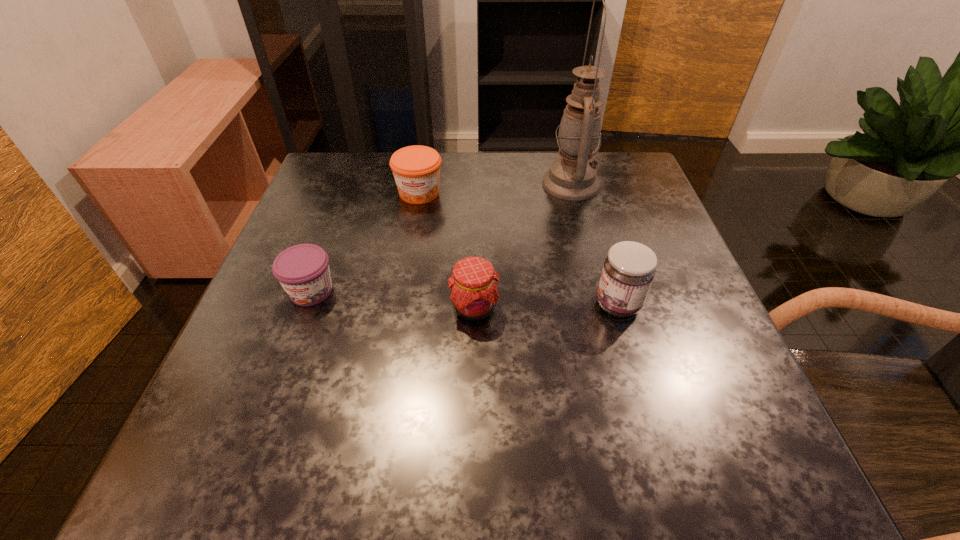
The height and width of the screenshot is (540, 960). Identify the location of free area in between the farthest jam and the leftmost jam. (365, 242).

Image resolution: width=960 pixels, height=540 pixels. What are the coordinates of `empty space between the third object from right to left and the oil lamp` in the screenshot? It's located at (522, 246).

Find the location of a particular element. This screenshot has height=540, width=960. empty space between the second object from left to right and the third jam from left to right is located at coordinates (446, 251).

Where is `unoccupied position between the shortest object and the farthest jam`? Image resolution: width=960 pixels, height=540 pixels. unoccupied position between the shortest object and the farthest jam is located at coordinates (365, 242).

I want to click on free point between the shortest object and the third jam from right to left, so click(x=365, y=242).

Identify the location of vacant space that's between the fourth object from right to left and the tallest object. The height and width of the screenshot is (540, 960). (495, 188).

Locate an element on the screen. vacant area that lies between the second jam from right to left and the tallest object is located at coordinates (522, 246).

Image resolution: width=960 pixels, height=540 pixels. What are the coordinates of `the closest object relative to the tallest jam` in the screenshot? It's located at (474, 294).

Identify the location of object that is the third closest to the second object from left to right. (474, 294).

Select which jam is the third closest to the tallest object. Please provide its 2D coordinates. Your answer should be formatted as a tuple, i.e. [(x, y)], where the tuple contains the x and y coordinates of a point satisfying the conditions above.

[(474, 294)]